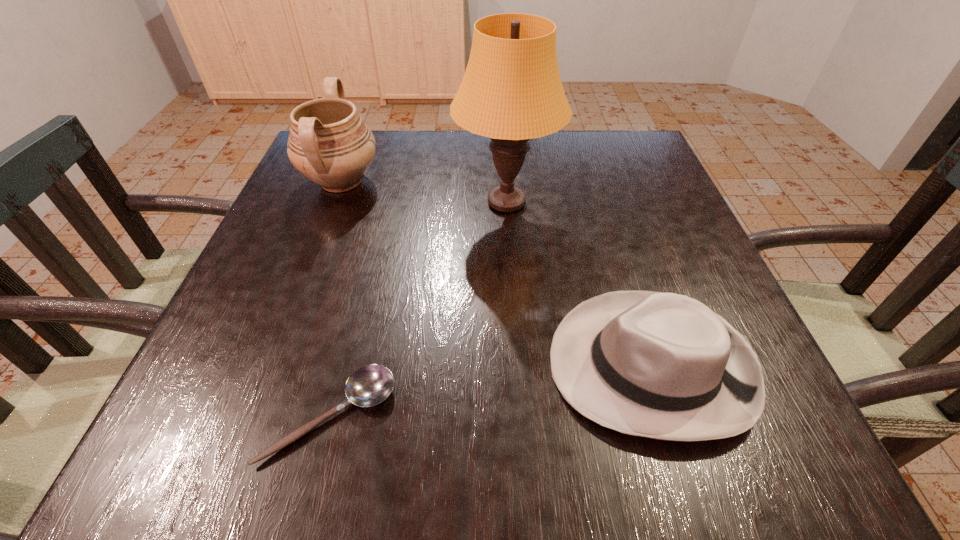
Where is `free space that satisfies the following two spatial constraints: 1. on the front-facing side of the lampshade; 2. on the right side of the urn`? The image size is (960, 540). free space that satisfies the following two spatial constraints: 1. on the front-facing side of the lampshade; 2. on the right side of the urn is located at coordinates pos(333,202).

I want to click on blank space that satisfies the following two spatial constraints: 1. on the front-facing side of the urn; 2. on the right side of the ladle, so click(x=252, y=416).

Locate an element on the screen. The width and height of the screenshot is (960, 540). free location that satisfies the following two spatial constraints: 1. on the back side of the shortest object; 2. on the right side of the tallest object is located at coordinates (384, 202).